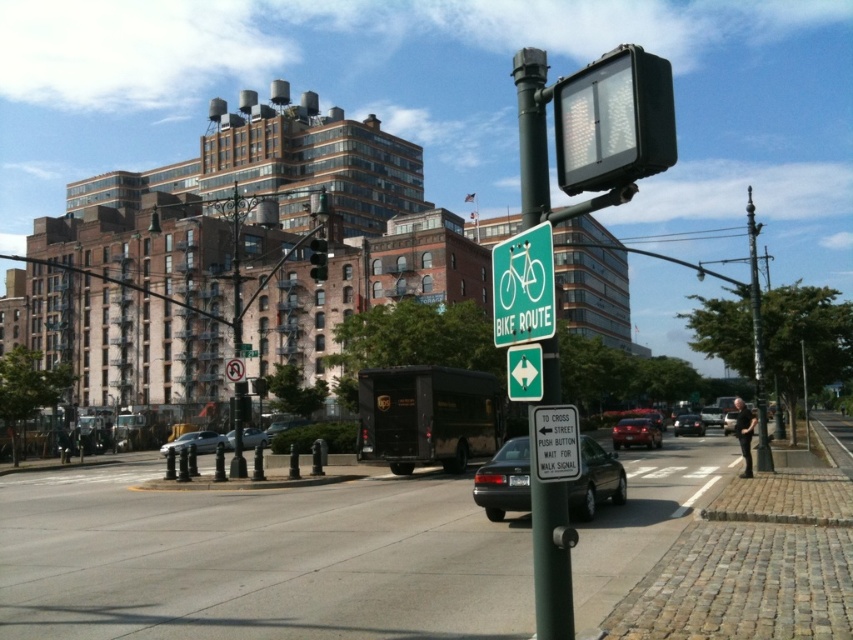
Does green plastic traffic sign at center appear on the right side of shiny red sedan at center?

In fact, green plastic traffic sign at center is to the left of shiny red sedan at center.

Is point (538, 362) closer to viewer compared to point (625, 420)?

Yes.

I want to click on green plastic traffic sign at center, so click(x=524, y=372).

Image resolution: width=853 pixels, height=640 pixels. Identify the location of green plastic traffic sign at center. (524, 372).

Who is higher up, black plastic traffic light at upper center or silver metallic sedan at center?

black plastic traffic light at upper center is above.

Is black plastic traffic light at upper center behind silver metallic sedan at center?

No, black plastic traffic light at upper center is in front of silver metallic sedan at center.

What do you see at coordinates (613, 120) in the screenshot? This screenshot has width=853, height=640. I see `black plastic traffic light at upper center` at bounding box center [613, 120].

Find the location of `black plastic traffic light at upper center`. black plastic traffic light at upper center is located at coordinates (613, 120).

Who is positioned more to the right, shiny black sedan at center or silver metallic pole at right?

From the viewer's perspective, silver metallic pole at right appears more on the right side.

Can you confirm if shiny black sedan at center is smaller than silver metallic pole at right?

Correct, shiny black sedan at center occupies less space than silver metallic pole at right.

Is point (525, 481) less distant than point (763, 392)?

Yes, point (525, 481) is closer to viewer.

Image resolution: width=853 pixels, height=640 pixels. Identify the location of shiny black sedan at center. (503, 481).